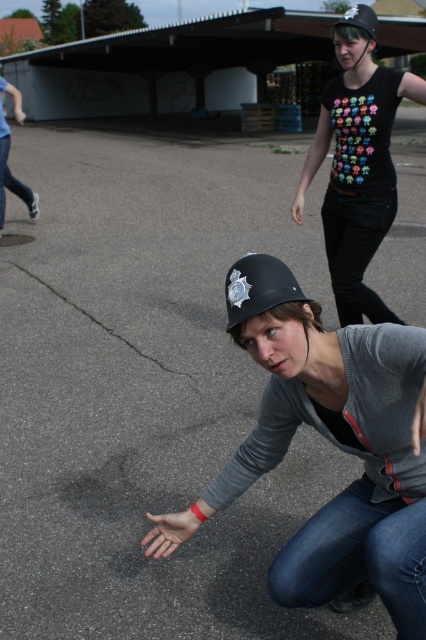
You are a safety inspector checking the helmets in the image. The two helmets are labeled as matte black helmet at center and black matte helmet at upper center. Which helmet has a lower height?

The matte black helmet at center has a lesser height compared to the black matte helmet at upper center, so the matte black helmet at center is the one with lower height.